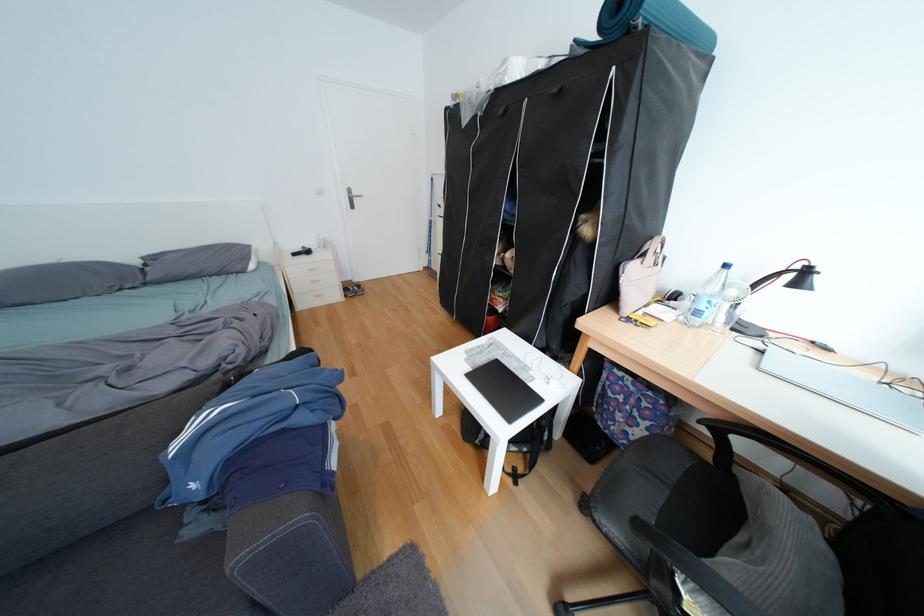
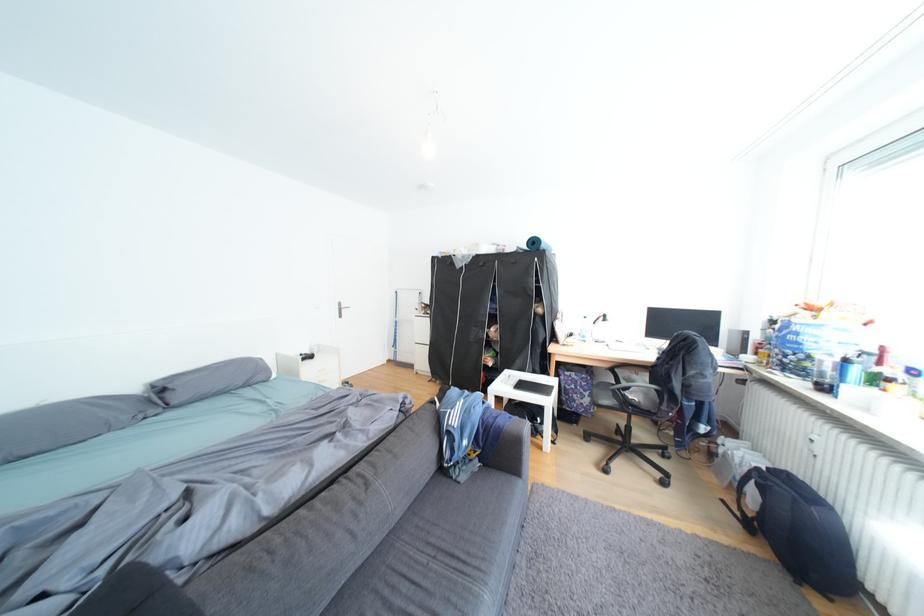
Find the pixel in the second image that matches (205,487) in the first image.

(478, 444)